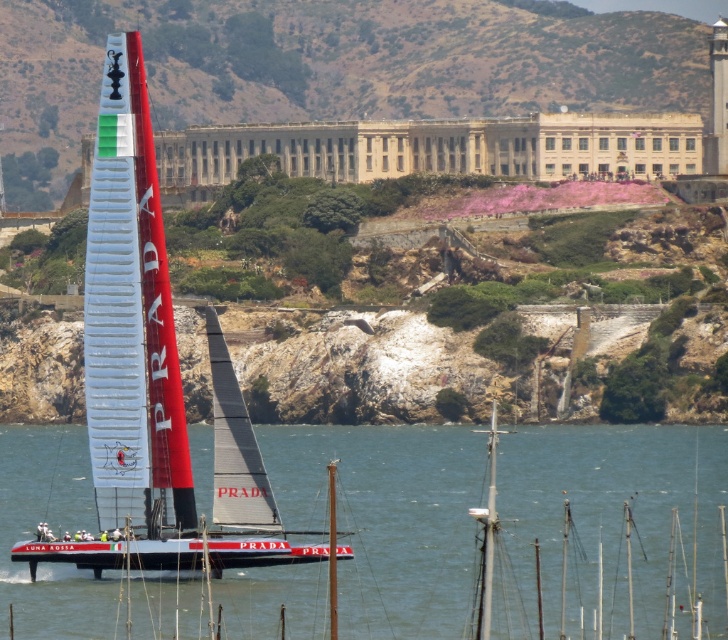
You are a photographer trying to capture the white glossy sailboat at center from above. Can you see the transparent water at center through your camera lens while focusing on the sailboat?

Yes, because the transparent water at center is below the white glossy sailboat at center, so when focusing on the sailboat, the water will be visible beneath it in the frame.

You are standing on the deck of the sailboat and looking at two points in the water. The first point is at coordinates point [590,563] and the second point is at point [298,552]. Which point is closer to you?

Point [590,563] is further to the viewer than point [298,552], so the second point is closer to you.